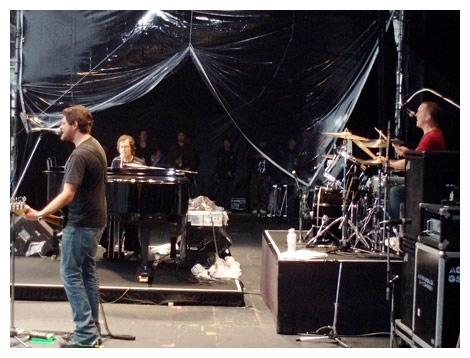
Locate an element on the screen. The width and height of the screenshot is (470, 358). speakers is located at coordinates click(x=422, y=174).